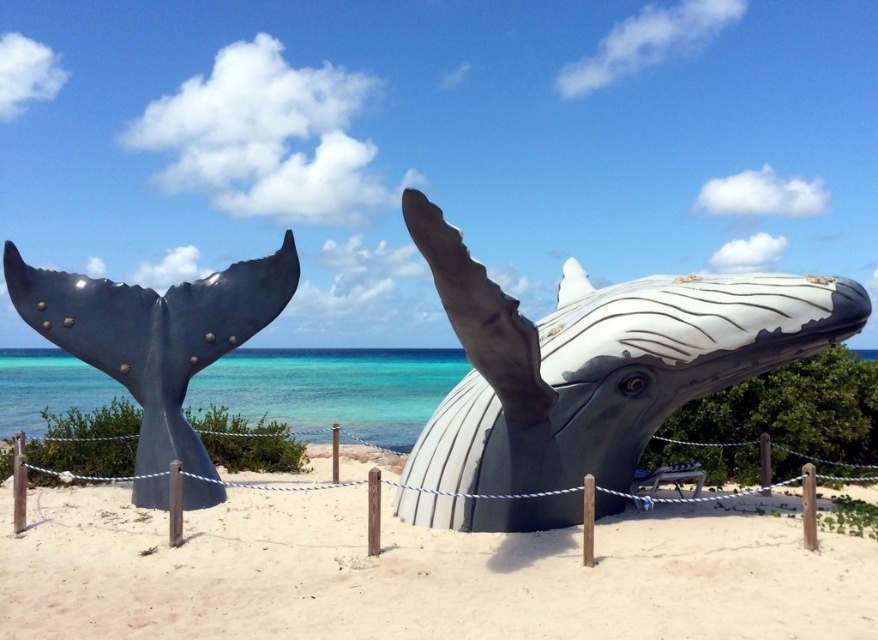
You are standing on the beach and want to take a photo of the metallic gray whale tail at left. If your camera has a maximum zoom range of 5 meters, can you capture the entire tail in one shot without moving closer?

The metallic gray whale tail at left is 5.90 meters away from the viewer. Since the camera can only zoom up to 5 meters, you cannot capture the entire tail in one shot without moving closer.

You are standing on the beach and see the metallic gray whale at center and the metallic gray whale tail at left. Which one is positioned further to the left?

The metallic gray whale tail at left is positioned further to the left than the metallic gray whale at center.

You are standing on the beach and want to take a photo of the gray matte whale head at center. If you are positioned at coordinate point 0.567, 0.682, where should you aim your camera to capture the whale head perfectly?

The gray matte whale head at center is located exactly at coordinate point (598, 362), so you should aim your camera directly at that point to capture it perfectly.